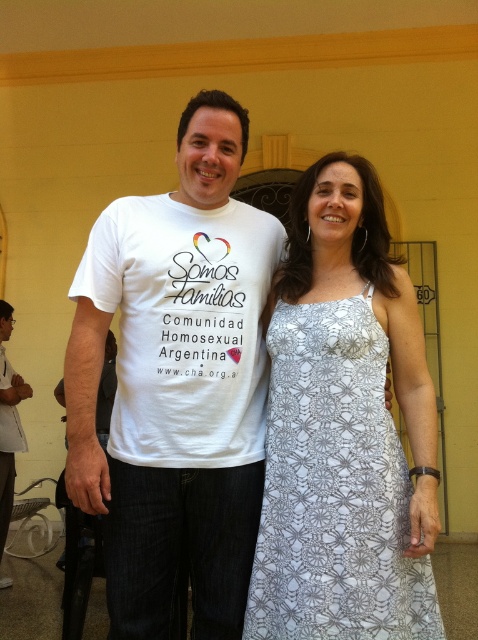
You are a photographer adjusting your camera focus. You need to focus on both the point at (373, 380) and the point at (3, 488). Which point should you adjust your focus to first if you want to capture the closest object first?

You should focus on point (373, 380) first because it is closer to the camera than point (3, 488).